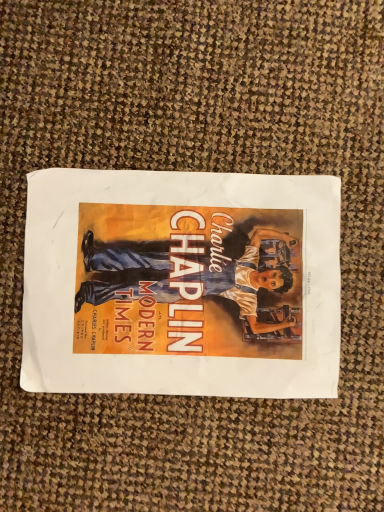
At what (x,y) coordinates should I click in order to perform the action: click on matte paper poster at center. Please return your answer as a coordinate pair (x, y). This screenshot has height=512, width=384. Looking at the image, I should click on pyautogui.click(x=181, y=284).

This screenshot has height=512, width=384. Describe the element at coordinates (181, 284) in the screenshot. I see `matte paper poster at center` at that location.

In order to face matte paper poster at center, should I rotate leftwards or rightwards?

Rotate left and turn 1.151 degrees.

At what (x,y) coordinates should I click in order to perform the action: click on matte paper poster at center. Please return your answer as a coordinate pair (x, y). The width and height of the screenshot is (384, 512). Looking at the image, I should click on (181, 284).